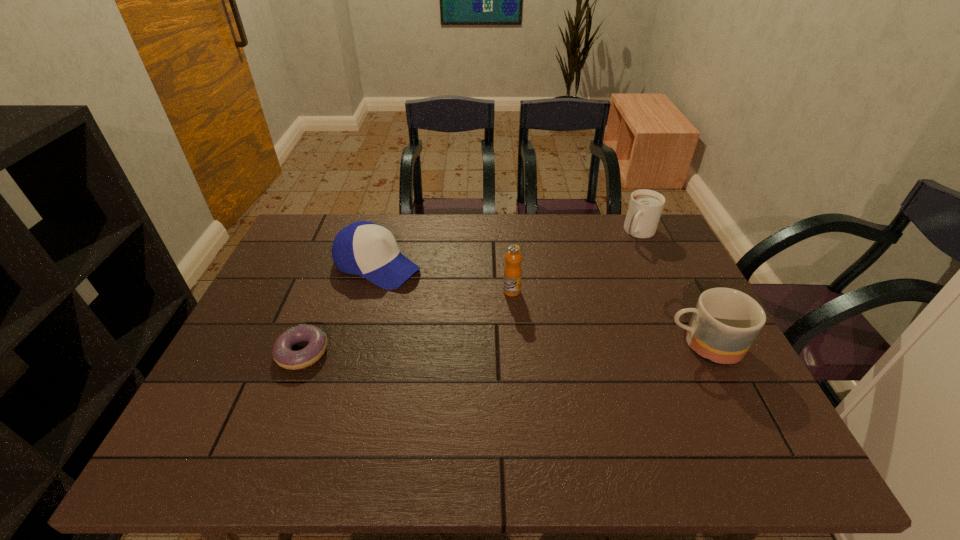
What are the coordinates of `object that is at the left edge` in the screenshot? It's located at (283, 355).

The height and width of the screenshot is (540, 960). I want to click on mug located at the right edge, so click(725, 322).

Identify the location of cappuccino present at the right edge. This screenshot has height=540, width=960. (645, 207).

Locate an element on the screen. object that is at the far right corner is located at coordinates (645, 207).

The height and width of the screenshot is (540, 960). I want to click on free space at the far edge, so click(x=498, y=246).

In the image, there is a desktop. Where is `vacant space at the near edge`? vacant space at the near edge is located at coordinates (396, 389).

In the image, there is a desktop. Identify the location of vacant space at the left edge. (298, 258).

Image resolution: width=960 pixels, height=540 pixels. What are the coordinates of `free point at the right edge` in the screenshot? It's located at (660, 259).

You are a GUI agent. You are given a task and a screenshot of the screen. Output one action in this format:
    pyautogui.click(x=<x>, y=<y>)
    Task: Click on the blank area at the far right corner
    This screenshot has height=540, width=960.
    Given the screenshot: What is the action you would take?
    pyautogui.click(x=648, y=254)

Find the location of a particular element. The height and width of the screenshot is (540, 960). free space between the shortest object and the cappuccino is located at coordinates (471, 292).